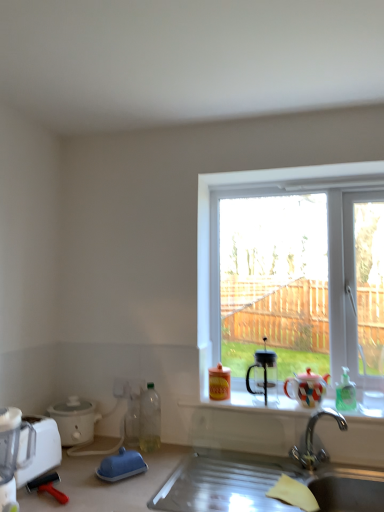
Question: Can you confirm if silver metallic faucet at lower center is smaller than transparent glass coffee maker at window?

Choices:
 (A) yes
 (B) no

Answer: (B)

Question: Does silver metallic faucet at lower center contain transparent glass coffee maker at window?

Choices:
 (A) no
 (B) yes

Answer: (A)

Question: Considering the relative sizes of silver metallic faucet at lower center and transparent glass coffee maker at window in the image provided, is silver metallic faucet at lower center thinner than transparent glass coffee maker at window?

Choices:
 (A) yes
 (B) no

Answer: (B)

Question: Can you confirm if silver metallic faucet at lower center is positioned to the left of transparent glass coffee maker at window?

Choices:
 (A) yes
 (B) no

Answer: (B)

Question: Is silver metallic faucet at lower center taller than transparent glass coffee maker at window?

Choices:
 (A) no
 (B) yes

Answer: (A)

Question: From the image's perspective, is silver metallic faucet at lower center below transparent glass coffee maker at window?

Choices:
 (A) yes
 (B) no

Answer: (A)

Question: From the image's perspective, is translucent plastic bottle at lower left, arranged as the 3th bottle when viewed from the right, on top of matte ceramic teapot at window?

Choices:
 (A) no
 (B) yes

Answer: (A)

Question: Are translucent plastic bottle at lower left, placed as the 1th bottle when sorted from left to right, and matte ceramic teapot at window located far from each other?

Choices:
 (A) no
 (B) yes

Answer: (A)

Question: Can we say translucent plastic bottle at lower left, placed as the 1th bottle when sorted from left to right, lies outside matte ceramic teapot at window?

Choices:
 (A) no
 (B) yes

Answer: (B)

Question: Is translucent plastic bottle at lower left, placed as the 1th bottle when sorted from left to right, aimed at matte ceramic teapot at window?

Choices:
 (A) no
 (B) yes

Answer: (A)

Question: Is translucent plastic bottle at lower left, arranged as the 3th bottle when viewed from the right, facing away from matte ceramic teapot at window?

Choices:
 (A) yes
 (B) no

Answer: (B)

Question: Can you confirm if translucent plastic bottle at lower left, arranged as the 3th bottle when viewed from the right, is positioned to the right of matte ceramic teapot at window?

Choices:
 (A) yes
 (B) no

Answer: (B)

Question: Is white matte slow cooker at lower left, the 3th appliance from the front, shorter than white plastic blender at lower left?

Choices:
 (A) no
 (B) yes

Answer: (B)